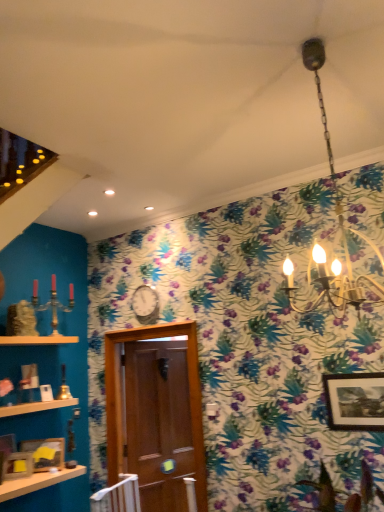
What is the approximate width of wooden picture frame at lower left, the first picture frame from the left?

It is 3.29 inches.

This screenshot has width=384, height=512. What do you see at coordinates (145, 304) in the screenshot?
I see `metallic silver clock at center` at bounding box center [145, 304].

Measure the distance between wooden shelf at lower left, the 1th shelf positioned from the top, and camera.

3.23 meters.

Measure the distance between wooden photo frame at lower left, positioned as the third picture frame in right-to-left order, and camera.

3.05 meters.

The height and width of the screenshot is (512, 384). What do you see at coordinates (18, 465) in the screenshot?
I see `wooden photo frame at lower left, positioned as the third picture frame in right-to-left order` at bounding box center [18, 465].

Based on the photo, what is the approximate width of wooden picture frame at lower left, which ranks as the third picture frame in left-to-right order?

The width of wooden picture frame at lower left, which ranks as the third picture frame in left-to-right order, is 2.50 inches.

In the scene shown: What is the approximate height of wooden picture frame at lower left, positioned as the 2th picture frame in right-to-left order?

It is 11.06 inches.

You are a GUI agent. You are given a task and a screenshot of the screen. Output one action in this format:
    pyautogui.click(x=<x>, y=<y>)
    Task: Click on the wooden picture frame at upper right, the 1th picture frame positioned from the right
    The image size is (384, 512).
    Given the screenshot: What is the action you would take?
    pyautogui.click(x=355, y=401)

Considering the sizes of objects wooden photo frame at lower left, positioned as the third picture frame in right-to-left order, and wooden shelf at lower left, the 2th shelf when ordered from top to bottom, in the image provided, who is wider, wooden photo frame at lower left, positioned as the third picture frame in right-to-left order, or wooden shelf at lower left, the 2th shelf when ordered from top to bottom,?

With larger width is wooden shelf at lower left, the 2th shelf when ordered from top to bottom.

Find the location of `the 1st picture frame to the left of the wooden shelf at lower left, the 2th shelf when ordered from top to bottom, counting from the anchor's position`. the 1st picture frame to the left of the wooden shelf at lower left, the 2th shelf when ordered from top to bottom, counting from the anchor's position is located at coordinates (18, 465).

Is wooden photo frame at lower left, positioned as the third picture frame in right-to-left order, oriented away from wooden shelf at lower left, marked as the 1th shelf in a bottom-to-top arrangement?

wooden photo frame at lower left, positioned as the third picture frame in right-to-left order, is not turned away from wooden shelf at lower left, marked as the 1th shelf in a bottom-to-top arrangement.

Considering the points (350, 268) and (333, 426), which point is behind, point (350, 268) or point (333, 426)?

The point (350, 268) is behind.

Does gold metallic chandelier at upper center turn towards wooden picture frame at upper right, the 1th picture frame positioned from the right?

No, gold metallic chandelier at upper center is not turned towards wooden picture frame at upper right, the 1th picture frame positioned from the right.

How many degrees apart are the facing directions of gold metallic chandelier at upper center and wooden picture frame at upper right, the 1th picture frame positioned from the right?

gold metallic chandelier at upper center and wooden picture frame at upper right, the 1th picture frame positioned from the right, are facing 2.22 degrees away from each other.

Are gold metallic chandelier at upper center and wooden picture frame at upper right, the 1th picture frame positioned from the right, making contact?

No, gold metallic chandelier at upper center is not touching wooden picture frame at upper right, the 1th picture frame positioned from the right.

What's the angular difference between wooden shelf at lower left, the 1th shelf positioned from the top, and wooden shelf at lower left, marked as the 1th shelf in a bottom-to-top arrangement,'s facing directions?

The facing directions of wooden shelf at lower left, the 1th shelf positioned from the top, and wooden shelf at lower left, marked as the 1th shelf in a bottom-to-top arrangement, are 0.000601 degrees apart.

Is wooden shelf at lower left, the 2th shelf in the bottom-to-top sequence, completely or partially outside of wooden shelf at lower left, marked as the 1th shelf in a bottom-to-top arrangement?

Yes, wooden shelf at lower left, the 2th shelf in the bottom-to-top sequence, is not within wooden shelf at lower left, marked as the 1th shelf in a bottom-to-top arrangement.

Is wooden shelf at lower left, the 1th shelf positioned from the top, next to wooden shelf at lower left, the 2th shelf when ordered from top to bottom, and touching it?

No, wooden shelf at lower left, the 1th shelf positioned from the top, is not next to wooden shelf at lower left, the 2th shelf when ordered from top to bottom.

From the image's perspective, does wooden shelf at lower left, the 2th shelf in the bottom-to-top sequence, appear higher than wooden shelf at lower left, marked as the 1th shelf in a bottom-to-top arrangement?

Yes, from the image's perspective, wooden shelf at lower left, the 2th shelf in the bottom-to-top sequence, is over wooden shelf at lower left, marked as the 1th shelf in a bottom-to-top arrangement.

Relative to wooden picture frame at lower left, the first picture frame from the left, is wooden picture frame at lower left, which ranks as the third picture frame in left-to-right order, in front or behind?

Clearly, wooden picture frame at lower left, which ranks as the third picture frame in left-to-right order, is behind wooden picture frame at lower left, the first picture frame from the left.

Which of these two, wooden picture frame at lower left, which ranks as the third picture frame in left-to-right order, or wooden picture frame at lower left, the first picture frame from the left, is thinner?

With smaller width is wooden picture frame at lower left, which ranks as the third picture frame in left-to-right order.

From a real-world perspective, is wooden picture frame at lower left, positioned as the 2th picture frame in right-to-left order, physically located above or below wooden picture frame at lower left, the first picture frame from the left?

Clearly, from a real-world perspective, wooden picture frame at lower left, positioned as the 2th picture frame in right-to-left order, is below wooden picture frame at lower left, the first picture frame from the left.

Which of these two, wooden picture frame at lower left, which ranks as the third picture frame in left-to-right order, or wooden picture frame at lower left, arranged as the fourth picture frame when viewed from the right, is bigger?

wooden picture frame at lower left, arranged as the fourth picture frame when viewed from the right, is bigger.

From a real-world perspective, is wooden shelf at lower left, the 2th shelf when ordered from top to bottom, above or below wooden picture frame at lower left, the first picture frame from the left?

wooden shelf at lower left, the 2th shelf when ordered from top to bottom, is situated higher than wooden picture frame at lower left, the first picture frame from the left, in the real world.

Which of these two, wooden shelf at lower left, the 2th shelf when ordered from top to bottom, or wooden picture frame at lower left, arranged as the fourth picture frame when viewed from the right, is smaller?

wooden picture frame at lower left, arranged as the fourth picture frame when viewed from the right.

What's the angular difference between wooden shelf at lower left, marked as the 1th shelf in a bottom-to-top arrangement, and wooden picture frame at lower left, arranged as the fourth picture frame when viewed from the right,'s facing directions?

There is a 0.691-degree angle between the facing directions of wooden shelf at lower left, marked as the 1th shelf in a bottom-to-top arrangement, and wooden picture frame at lower left, arranged as the fourth picture frame when viewed from the right.

Would you say wooden shelf at lower left, marked as the 1th shelf in a bottom-to-top arrangement, is outside wooden picture frame at lower left, arranged as the fourth picture frame when viewed from the right?

wooden shelf at lower left, marked as the 1th shelf in a bottom-to-top arrangement, lies outside wooden picture frame at lower left, arranged as the fourth picture frame when viewed from the right,'s area.

Is wooden picture frame at upper right, arranged as the fourth picture frame when viewed from the left, to the left of wooden photo frame at lower left, positioned as the third picture frame in right-to-left order, from the viewer's perspective?

Incorrect, wooden picture frame at upper right, arranged as the fourth picture frame when viewed from the left, is not on the left side of wooden photo frame at lower left, positioned as the third picture frame in right-to-left order.

Is wooden picture frame at upper right, arranged as the fourth picture frame when viewed from the left, aimed at wooden photo frame at lower left, positioned as the third picture frame in right-to-left order?

No, wooden picture frame at upper right, arranged as the fourth picture frame when viewed from the left, does not turn towards wooden photo frame at lower left, positioned as the third picture frame in right-to-left order.

Between wooden picture frame at upper right, the 1th picture frame positioned from the right, and wooden photo frame at lower left, positioned as the third picture frame in right-to-left order, which one has smaller width?

Thinner between the two is wooden photo frame at lower left, positioned as the third picture frame in right-to-left order.

From the image's perspective, is metallic silver clock at center located beneath wooden picture frame at lower left, arranged as the fourth picture frame when viewed from the right?

No, from the image's perspective, metallic silver clock at center is not beneath wooden picture frame at lower left, arranged as the fourth picture frame when viewed from the right.

I want to click on the 2nd picture frame directly beneath the metallic silver clock at center (from a real-world perspective), so [6, 449].

From a real-world perspective, which object rests below the other?

wooden picture frame at lower left, the first picture frame from the left.

From the wooden shelf at lower left, marked as the 1th shelf in a bottom-to-top arrangement, count the 1st picture frame to the left and point to it. Please provide its 2D coordinates.

[(18, 465)]

Identify the location of lamp lying above the wooden picture frame at upper right, the 1th picture frame positioned from the right (from the image's perspective). (339, 226).

Estimate the real-world distances between objects in this image. Which object is further from wooden picture frame at lower left, the first picture frame from the left, wooden shelf at lower left, the 2th shelf in the bottom-to-top sequence, or wooden shelf at lower left, marked as the 1th shelf in a bottom-to-top arrangement?

Among the two, wooden shelf at lower left, the 2th shelf in the bottom-to-top sequence, is located further to wooden picture frame at lower left, the first picture frame from the left.

From the image, which object appears to be nearer to wooden shelf at lower left, the 1th shelf positioned from the top, wooden shelf at lower left or wooden photo frame at lower left, positioned as the 2th picture frame in left-to-right order?

wooden photo frame at lower left, positioned as the 2th picture frame in left-to-right order, is positioned closer to the anchor wooden shelf at lower left, the 1th shelf positioned from the top.

From the image, which object appears to be farther from wooden picture frame at upper right, arranged as the fourth picture frame when viewed from the left, metallic silver clock at center or wooden shelf at lower left?

Among the two, wooden shelf at lower left is located further to wooden picture frame at upper right, arranged as the fourth picture frame when viewed from the left.

Estimate the real-world distances between objects in this image. Which object is closer to wooden picture frame at lower left, which ranks as the third picture frame in left-to-right order, wooden picture frame at upper right, the 1th picture frame positioned from the right, or wooden shelf at lower left, the 2th shelf in the bottom-to-top sequence?

Based on the image, wooden shelf at lower left, the 2th shelf in the bottom-to-top sequence, appears to be nearer to wooden picture frame at lower left, which ranks as the third picture frame in left-to-right order.

When comparing their distances from metallic silver clock at center, does brown wooden door at center or wooden picture frame at lower left, which ranks as the third picture frame in left-to-right order, seem further?

wooden picture frame at lower left, which ranks as the third picture frame in left-to-right order, lies further to metallic silver clock at center than the other object.

Estimate the real-world distances between objects in this image. Which object is further from wooden picture frame at upper right, arranged as the fourth picture frame when viewed from the left, wooden picture frame at lower left, positioned as the 2th picture frame in right-to-left order, or gold metallic chandelier at upper center?

The object further to wooden picture frame at upper right, arranged as the fourth picture frame when viewed from the left, is wooden picture frame at lower left, positioned as the 2th picture frame in right-to-left order.

Based on their spatial positions, is gold metallic chandelier at upper center or wooden photo frame at lower left, positioned as the third picture frame in right-to-left order, further from wooden shelf at lower left, marked as the 1th shelf in a bottom-to-top arrangement?

gold metallic chandelier at upper center.

When comparing their distances from wooden shelf at lower left, the 1th shelf positioned from the top, does brown wooden door at center or metallic silver clock at center seem closer?

metallic silver clock at center.

Where is `door positioned between gold metallic chandelier at upper center and wooden picture frame at lower left, which ranks as the third picture frame in left-to-right order, from near to far`? door positioned between gold metallic chandelier at upper center and wooden picture frame at lower left, which ranks as the third picture frame in left-to-right order, from near to far is located at coordinates (156, 413).

Locate an element on the screen. This screenshot has width=384, height=512. picture frame between wooden shelf at lower left and wooden picture frame at upper right, the 1th picture frame positioned from the right is located at coordinates tap(45, 453).

The width and height of the screenshot is (384, 512). I want to click on picture frame between wooden shelf at lower left, the 2th shelf when ordered from top to bottom, and wooden photo frame at lower left, positioned as the third picture frame in right-to-left order, in the vertical direction, so click(x=6, y=449).

Locate an element on the screen. The width and height of the screenshot is (384, 512). clock between wooden shelf at lower left, the 2th shelf in the bottom-to-top sequence, and brown wooden door at center, in the horizontal direction is located at coordinates (145, 304).